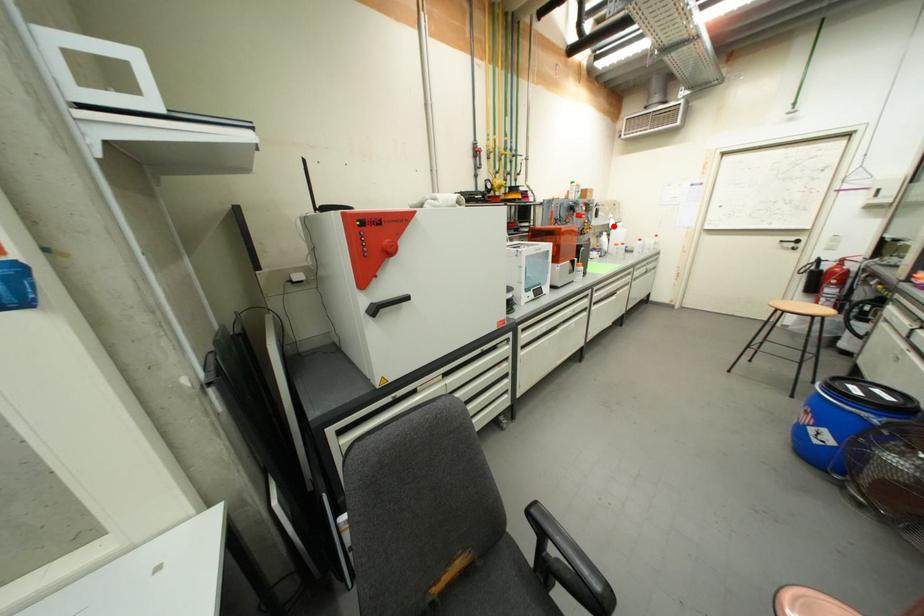
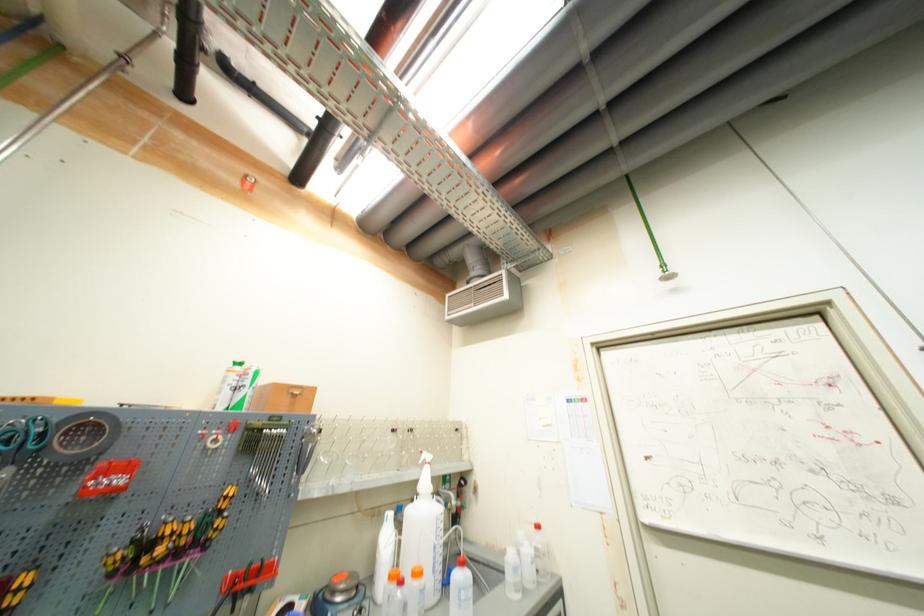
Question: I am providing you with two images of the same scene from different viewpoints. In image1, a red point is highlighted. Considering the same 3D point in image2, which of the following is correct?

Choices:
 (A) It is closer
 (B) It is farther

Answer: (B)